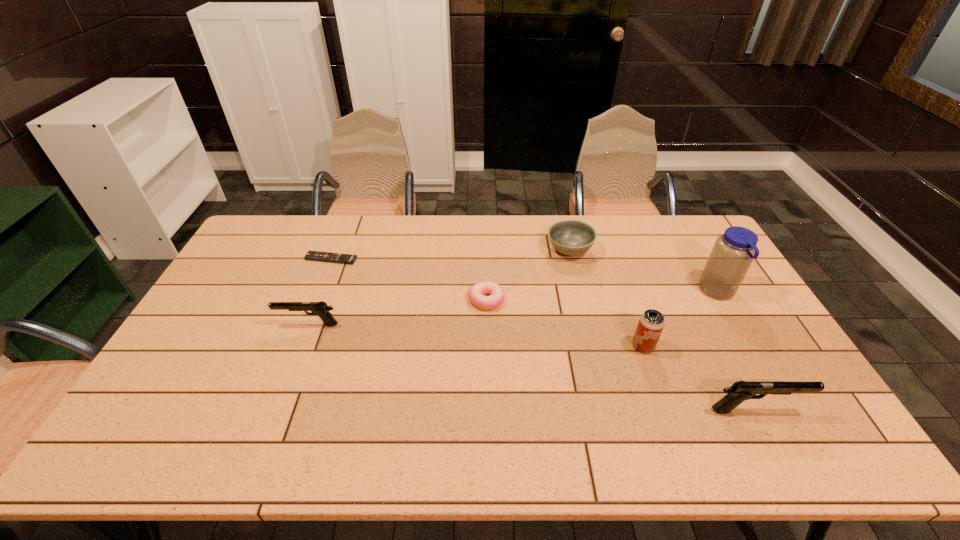
At what (x,y) coordinates should I click in order to perform the action: click on free region at the left edge of the desktop. Please return your answer as a coordinate pair (x, y). This screenshot has height=540, width=960. Looking at the image, I should click on (231, 316).

Identify the location of vacant space at the right edge of the desktop. The image size is (960, 540). (738, 359).

The image size is (960, 540). I want to click on blank area at the far left corner, so click(x=287, y=249).

What are the coordinates of `free space at the far right corner` in the screenshot? It's located at (675, 240).

Where is `free space at the near right corner of the desktop`? The height and width of the screenshot is (540, 960). free space at the near right corner of the desktop is located at coordinates (818, 413).

At what (x,y) coordinates should I click in order to perform the action: click on vacant area that lies between the water bottle and the right gun. Please return your answer as a coordinate pair (x, y). This screenshot has height=540, width=960. Looking at the image, I should click on (736, 351).

Identify the location of free spot between the sixth tallest object and the shortest object. Image resolution: width=960 pixels, height=540 pixels. (409, 279).

Where is `vacant area that lies between the bowl and the fourth tallest object`? vacant area that lies between the bowl and the fourth tallest object is located at coordinates (439, 287).

Identify the location of vacant space in between the doughnut and the nearest object. This screenshot has height=540, width=960. (621, 355).

Where is `vacant area that lies between the shorter gun and the third object from left to right`? vacant area that lies between the shorter gun and the third object from left to right is located at coordinates (397, 312).